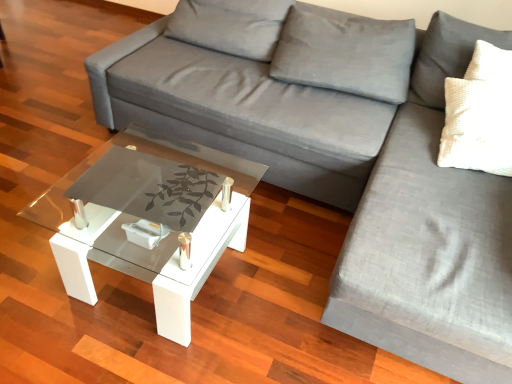
Question: Is transparent glass coffee table at center completely or partially inside gray fabric couch at right, which is the 1th couch from right to left?

Choices:
 (A) yes
 (B) no

Answer: (B)

Question: Considering the relative sizes of gray fabric couch at right, which is the 1th couch from right to left, and transparent glass coffee table at center in the image provided, is gray fabric couch at right, which is the 1th couch from right to left, shorter than transparent glass coffee table at center?

Choices:
 (A) yes
 (B) no

Answer: (B)

Question: Is gray fabric couch at right, which is the 1th couch from right to left, at the right side of transparent glass coffee table at center?

Choices:
 (A) no
 (B) yes

Answer: (B)

Question: Is gray fabric couch at right, which is the 1th couch from right to left, oriented towards transparent glass coffee table at center?

Choices:
 (A) yes
 (B) no

Answer: (B)

Question: Considering the relative sizes of gray fabric couch at right, which is the 1th couch from right to left, and transparent glass coffee table at center in the image provided, is gray fabric couch at right, which is the 1th couch from right to left, smaller than transparent glass coffee table at center?

Choices:
 (A) no
 (B) yes

Answer: (A)

Question: Considering the positions of gray fabric couch at right, which is the 1th couch from right to left, and gray fabric couch at center, the first couch when ordered from left to right, in the image, is gray fabric couch at right, which is the 1th couch from right to left, wider or thinner than gray fabric couch at center, the first couch when ordered from left to right,?

Choices:
 (A) wide
 (B) thin

Answer: (A)

Question: Do you think gray fabric couch at right, which is the 1th couch from right to left, is within gray fabric couch at center, the first couch when ordered from left to right, or outside of it?

Choices:
 (A) inside
 (B) outside

Answer: (B)

Question: Considering the positions of gray fabric couch at right, arranged as the 2th couch when viewed from the left, and gray fabric couch at center, which is the second couch in right-to-left order, in the image, is gray fabric couch at right, arranged as the 2th couch when viewed from the left, taller or shorter than gray fabric couch at center, which is the second couch in right-to-left order,?

Choices:
 (A) tall
 (B) short

Answer: (B)

Question: Does point (456, 281) appear closer or farther from the camera than point (335, 147)?

Choices:
 (A) closer
 (B) farther

Answer: (A)

Question: Is gray fabric couch at right, arranged as the 2th couch when viewed from the left, in front of or behind transparent glass coffee table at center in the image?

Choices:
 (A) front
 (B) behind

Answer: (A)

Question: Is point (497, 203) closer or farther from the camera than point (198, 153)?

Choices:
 (A) closer
 (B) farther

Answer: (A)

Question: From the image's perspective, is gray fabric couch at right, which is the 1th couch from right to left, positioned above or below transparent glass coffee table at center?

Choices:
 (A) above
 (B) below

Answer: (A)

Question: From a real-world perspective, is gray fabric couch at right, which is the 1th couch from right to left, physically located above or below transparent glass coffee table at center?

Choices:
 (A) above
 (B) below

Answer: (A)

Question: Considering the positions of point (308, 134) and point (72, 228), is point (308, 134) closer or farther from the camera than point (72, 228)?

Choices:
 (A) closer
 (B) farther

Answer: (B)

Question: From the image's perspective, is gray fabric couch at center, which is the second couch in right-to-left order, above or below transparent glass coffee table at center?

Choices:
 (A) above
 (B) below

Answer: (A)